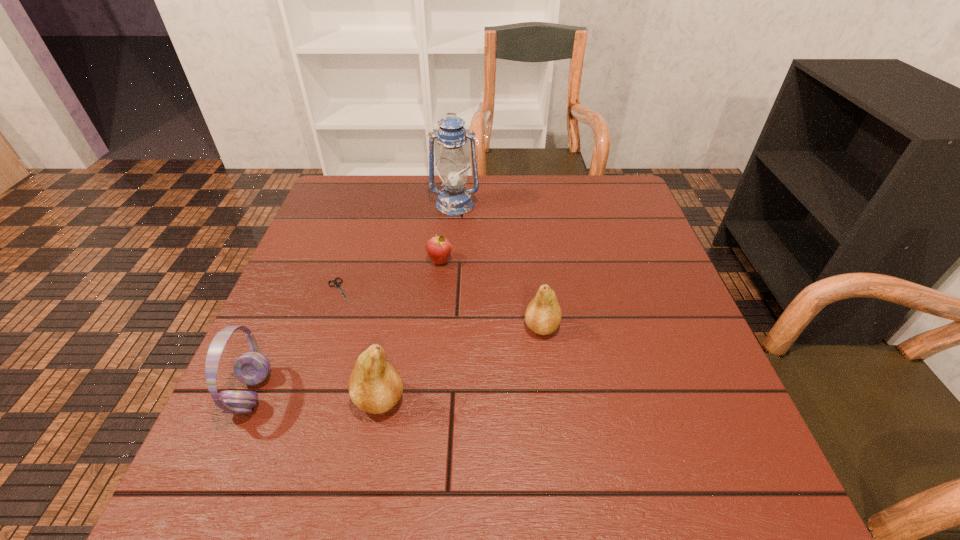
Identify the location of shears situated at the left edge. The height and width of the screenshot is (540, 960). (336, 284).

In order to click on headset present at the left edge in this screenshot , I will do point(251,368).

The image size is (960, 540). I want to click on object at the near left corner, so click(x=251, y=368).

Identify the location of free space at the far edge of the desktop. (466, 183).

The height and width of the screenshot is (540, 960). What are the coordinates of `vacant area at the left edge` in the screenshot? It's located at (301, 291).

This screenshot has height=540, width=960. I want to click on free space at the right edge of the desktop, so click(x=612, y=243).

This screenshot has width=960, height=540. In order to click on free space at the far left corner of the desktop in this screenshot , I will do (x=331, y=187).

Where is `vacant space at the near left corner of the desktop`? vacant space at the near left corner of the desktop is located at coordinates (269, 418).

In the image, there is a desktop. Identify the location of blank space at the near right corner. (687, 426).

This screenshot has width=960, height=540. What are the coordinates of `free space between the farthest object and the leftmost object` in the screenshot? It's located at (353, 299).